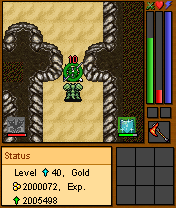
The height and width of the screenshot is (208, 176). I want to click on handle, so tap(161, 133).